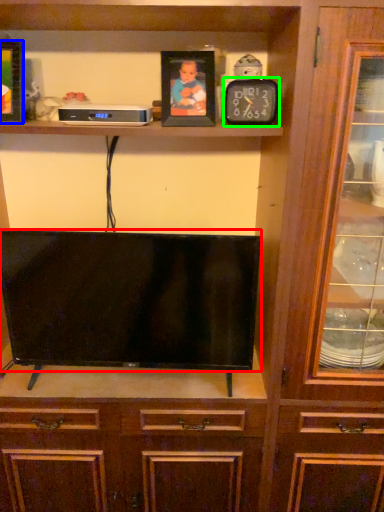
Question: Which is farther away from television (highlighted by a red box)? picture frame (highlighted by a blue box) or clock (highlighted by a green box)?

Choices:
 (A) picture frame
 (B) clock

Answer: (A)